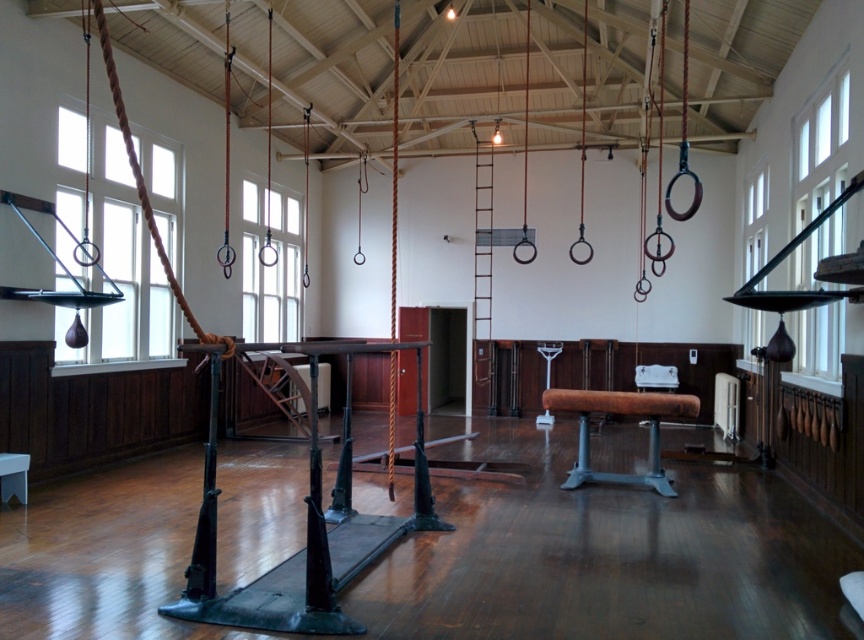
Question: Which point is closer to the camera?

Choices:
 (A) (16, 470)
 (B) (617, 392)

Answer: (A)

Question: Can you confirm if brown leather beam at center is positioned to the right of metallic stool at lower left?

Choices:
 (A) yes
 (B) no

Answer: (A)

Question: Can you confirm if brown leather beam at center is positioned to the right of metallic stool at lower left?

Choices:
 (A) no
 (B) yes

Answer: (B)

Question: Which point is farther from the camera taking this photo?

Choices:
 (A) (677, 406)
 (B) (3, 464)

Answer: (A)

Question: Considering the relative positions of brown leather beam at center and metallic stool at lower left in the image provided, where is brown leather beam at center located with respect to metallic stool at lower left?

Choices:
 (A) below
 (B) above

Answer: (B)